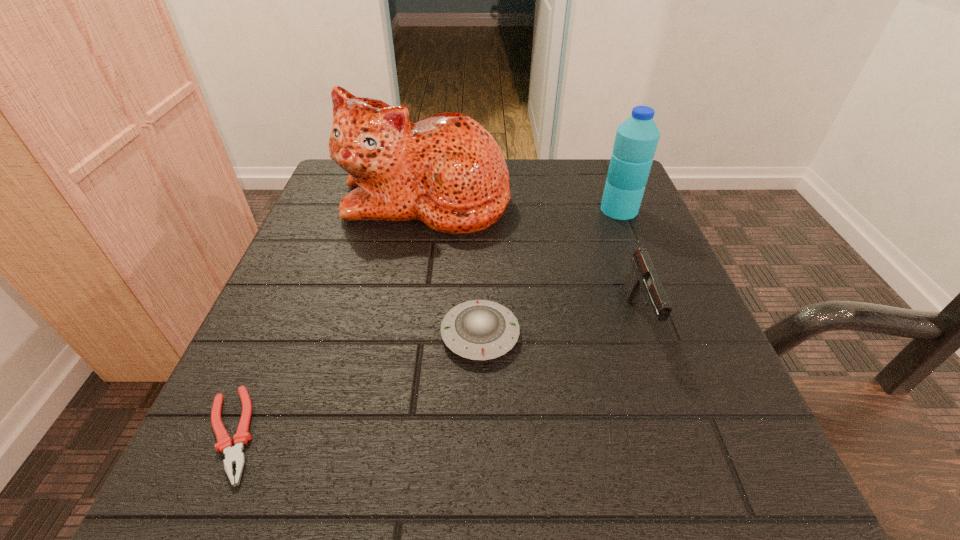
This screenshot has width=960, height=540. I want to click on cat, so click(x=446, y=170).

Locate an element on the screen. This screenshot has height=540, width=960. water bottle is located at coordinates (636, 140).

At what (x,y) coordinates should I click in order to perform the action: click on pistol. Please return your answer as a coordinate pair (x, y). This screenshot has height=540, width=960. Looking at the image, I should click on (643, 280).

At what (x,y) coordinates should I click in order to perform the action: click on the fourth tallest object. Please return your answer as a coordinate pair (x, y). This screenshot has width=960, height=540. Looking at the image, I should click on (481, 330).

Locate an element on the screen. the shortest object is located at coordinates (233, 454).

Identify the location of pliers. (233, 454).

In order to click on vacant area located on the face of the cat in this screenshot , I will do `click(405, 333)`.

Where is `vacant space located 0.360m on the left of the water bottle`? The height and width of the screenshot is (540, 960). vacant space located 0.360m on the left of the water bottle is located at coordinates (433, 209).

The width and height of the screenshot is (960, 540). Find the location of `vacant space situated 0.090m aim along the barrel of the third shortest object`. vacant space situated 0.090m aim along the barrel of the third shortest object is located at coordinates (669, 404).

Find the location of a particular element. vacant space located on the left of the fourth tallest object is located at coordinates (327, 334).